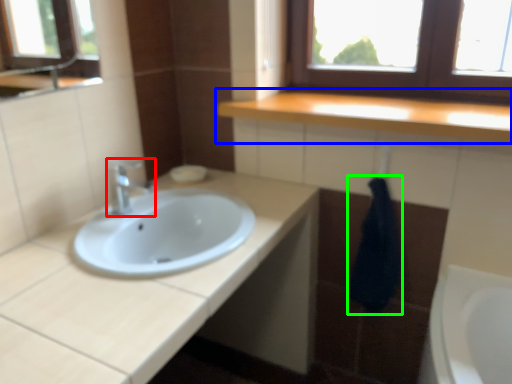
Question: Based on their relative distances, which object is nearer to tap (highlighted by a red box)? Choose from countertop (highlighted by a blue box) and bath towel (highlighted by a green box).

Choices:
 (A) countertop
 (B) bath towel

Answer: (A)